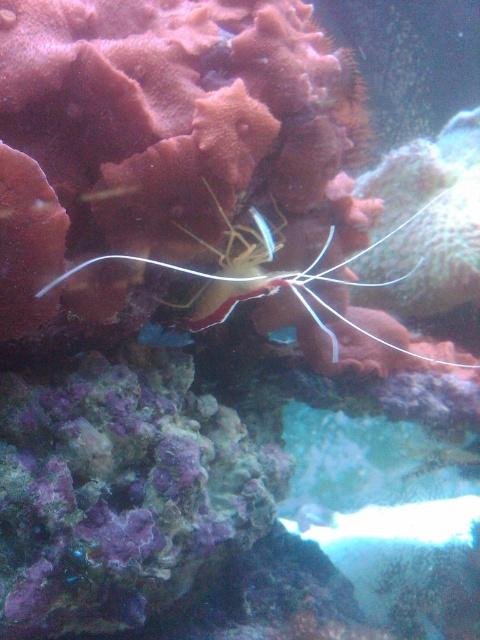
You are an underwater explorer observing the aquarium scene. You notice a translucent white shrimp at center and a shiny blue fish at center. Which one is positioned more to the right side of the aquarium?

The translucent white shrimp at center is positioned more to the right side of the aquarium compared to the shiny blue fish at center.

You are an underwater photographer aiming to capture both the shiny blue fish at center and the translucent white fish at center in a single frame. Based on their sizes, which fish should you focus on first to ensure both fit in the shot?

The shiny blue fish at center is not as tall as the translucent white fish at center, so you should focus on the translucent white fish at center first since it is taller and requires more space in the frame.